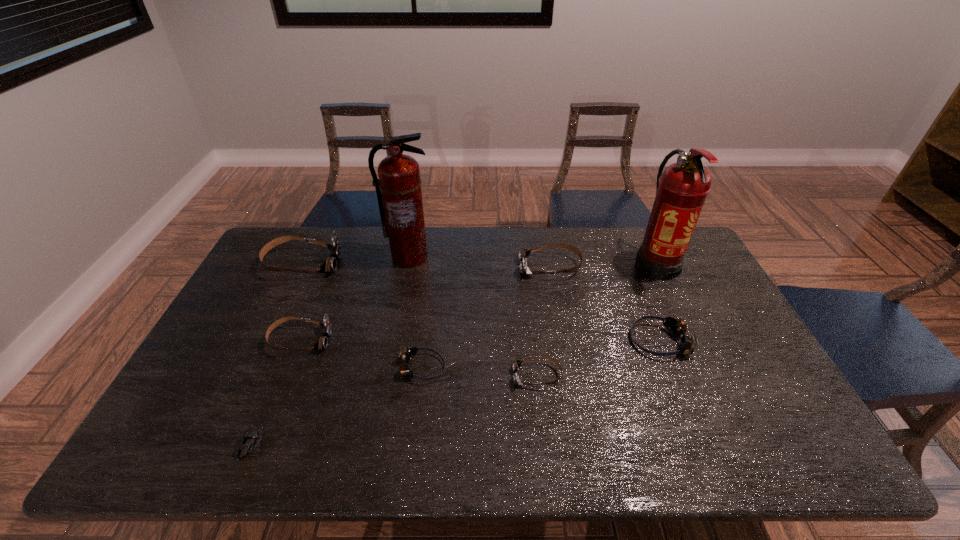
The width and height of the screenshot is (960, 540). Find the location of `goggles that is the third closest to the tallest goggles`. goggles that is the third closest to the tallest goggles is located at coordinates (523, 254).

Locate which goggles ranks fourth in proximity to the rightmost goggles. Please provide its 2D coordinates. Your answer should be formatted as a tuple, i.e. [(x, y)], where the tuple contains the x and y coordinates of a point satisfying the conditions above.

[(322, 342)]

Find the location of a particular element. brown goggles that is the fourth closest one to the nearest object is located at coordinates (523, 254).

Identify the location of the closest brown goggles to the second biggest brown goggles. (516, 364).

The image size is (960, 540). What are the coordinates of `vacant space that satisfies the following two spatial constraints: 1. on the front-facing side of the second biggest brown goggles; 2. on the front side of the nearest object` in the screenshot? It's located at (584, 445).

What are the coordinates of `free space that satisfies the following two spatial constraints: 1. on the front-facing side of the nearest brown goggles; 2. on the front side of the computer mouse` in the screenshot? It's located at (545, 445).